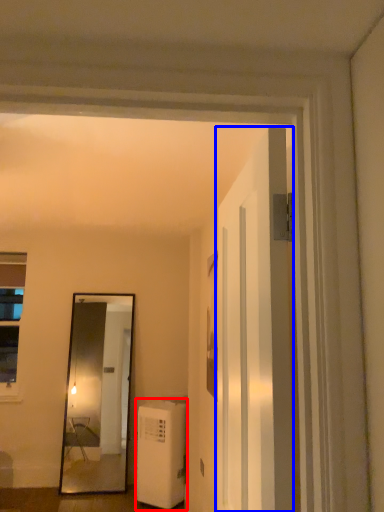
Question: Which point is closer to the camera, air conditioner (highlighted by a red box) or door (highlighted by a blue box)?

Choices:
 (A) air conditioner
 (B) door

Answer: (B)